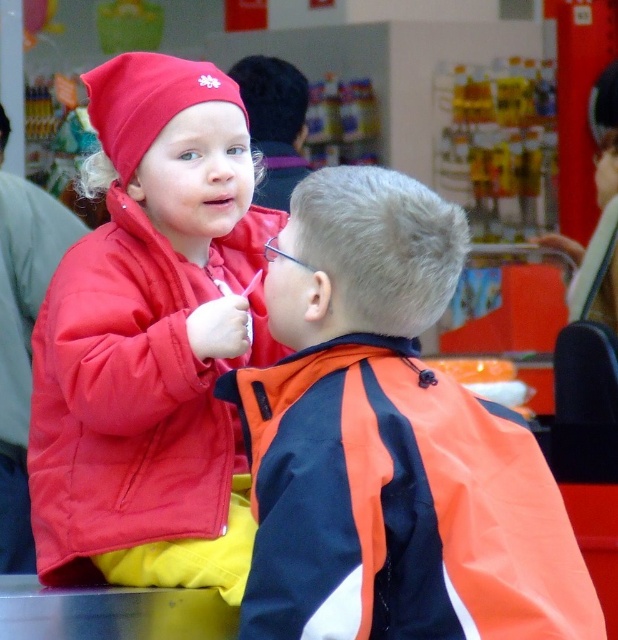
You are a photographer trying to capture a photo of both children in the store. You notice two points marked in the image. The first point is at coordinates point (x=373, y=340) and the second is at point (x=239, y=547). Which point should you focus on to ensure the child in the foreground is in sharp focus?

Point (x=373, y=340) is closer to the camera than point (x=239, y=547), so you should focus on point (x=373, y=340) to ensure the child in the foreground is in sharp focus.

What are the coordinates of the orange fabric jacket at center?

The orange fabric jacket at center is located at coordinates point (389, 444).